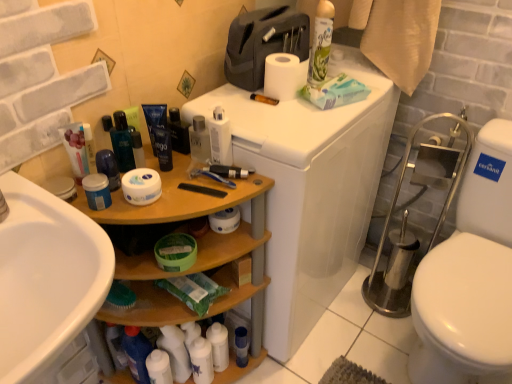
I want to click on space that is in front of white matte toilet paper at upper center, so click(293, 119).